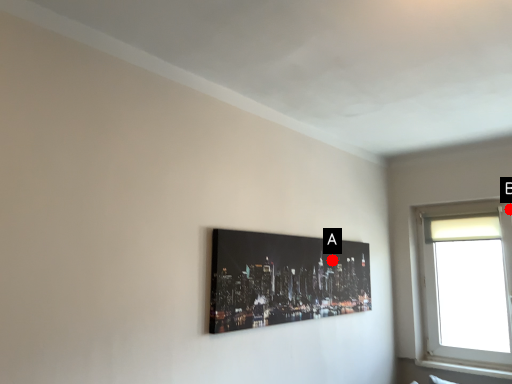
Question: Two points are circled on the image, labeled by A and B beside each circle. Which point is closer to the camera?

Choices:
 (A) A is closer
 (B) B is closer

Answer: (A)